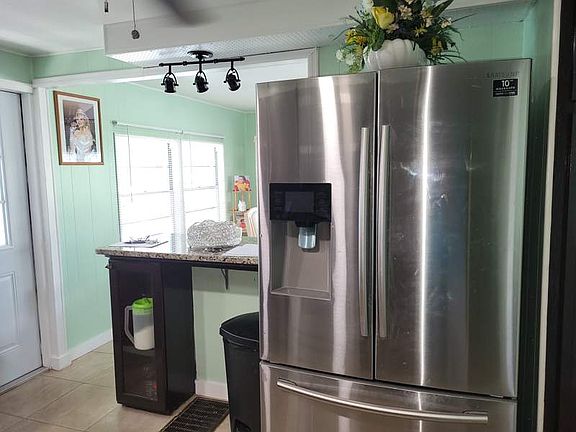
Identify the location of windows. (147, 184), (206, 161).